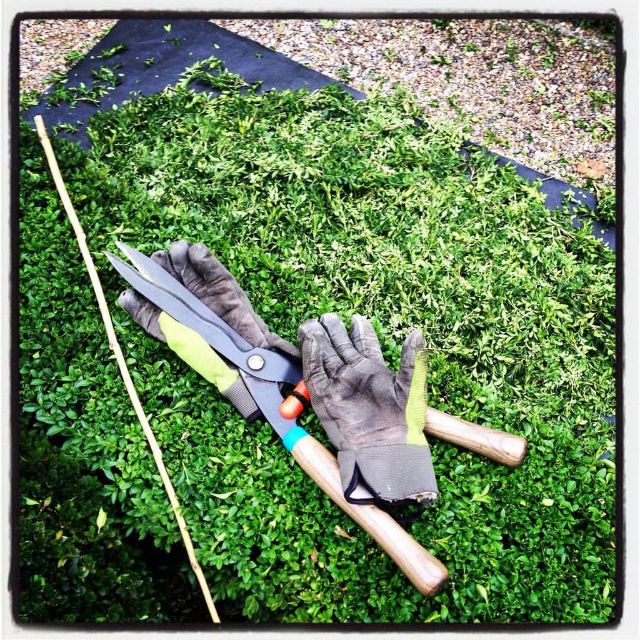
Question: Which point is farther to the camera?

Choices:
 (A) (381, 449)
 (B) (122, 262)

Answer: (B)

Question: Is gray fabric glove at center to the right of metallic shears at center from the viewer's perspective?

Choices:
 (A) yes
 (B) no

Answer: (A)

Question: Can you confirm if gray fabric glove at center is positioned to the right of metallic shears at center?

Choices:
 (A) no
 (B) yes

Answer: (B)

Question: Does gray fabric glove at center have a lesser width compared to metallic shears at center?

Choices:
 (A) no
 (B) yes

Answer: (B)

Question: Which of the following is the closest to the observer?

Choices:
 (A) (419, 464)
 (B) (426, 577)

Answer: (B)